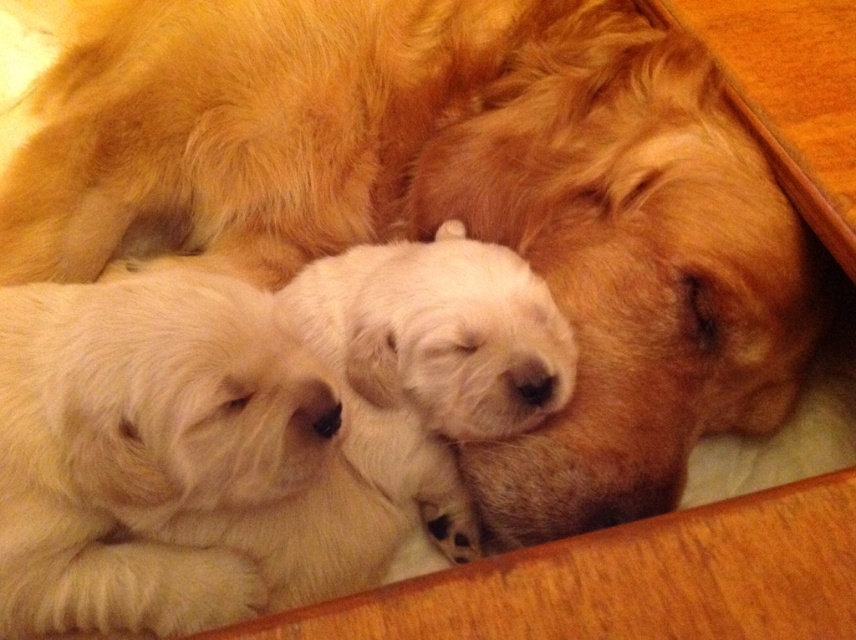
You are a photographer setting up a camera at eye level with the white fluffy puppy at left and the white fluffy puppies at center. Which group of puppies will appear taller in the photo?

The white fluffy puppies at center will appear taller in the photo because they are taller than the white fluffy puppy at left.

You are a veterinarian assessing the health of two white fluffy puppies in the image. The puppies are labeled as the white fluffy puppy at left and the white fluffy puppies at center. Based on their physical characteristics, which puppy might be at risk of malnutrition?

The white fluffy puppy at left is thinner than the white fluffy puppies at center, so it might be at risk of malnutrition.